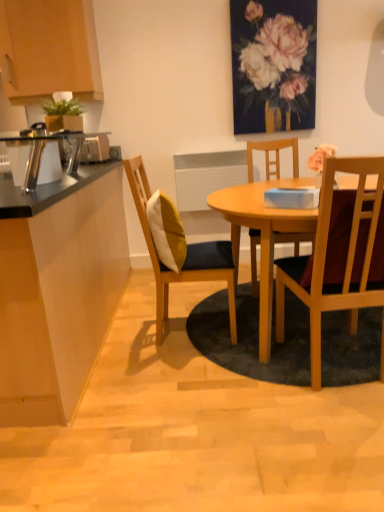
Question: In terms of width, does wooden chair with cushion at center, which is the 1th chair in left-to-right order, look wider or thinner when compared to wooden chair at right, which ranks as the second chair in left-to-right order?

Choices:
 (A) thin
 (B) wide

Answer: (B)

Question: Does point (135, 176) appear closer or farther from the camera than point (337, 160)?

Choices:
 (A) farther
 (B) closer

Answer: (A)

Question: Considering the real-world distances, which object is farthest from the metallic silver toaster at left, arranged as the 2th appliance when viewed from the back?

Choices:
 (A) matte white desk at left
 (B) yellow fabric pillow at center
 (C) wooden chair at right, which is the first chair in right-to-left order
 (D) matte floral painting at upper center
 (E) metallic silver toaster at left, the 1th appliance when ordered from back to front

Answer: (D)

Question: Estimate the real-world distances between objects in this image. Which object is closer to the yellow fabric pillow at center?

Choices:
 (A) matte white desk at left
 (B) metallic silver toaster at left, the second appliance from the bottom
 (C) wooden cabinet at upper left
 (D) wooden chair at right, which is the first chair in right-to-left order
 (E) matte floral painting at upper center

Answer: (A)